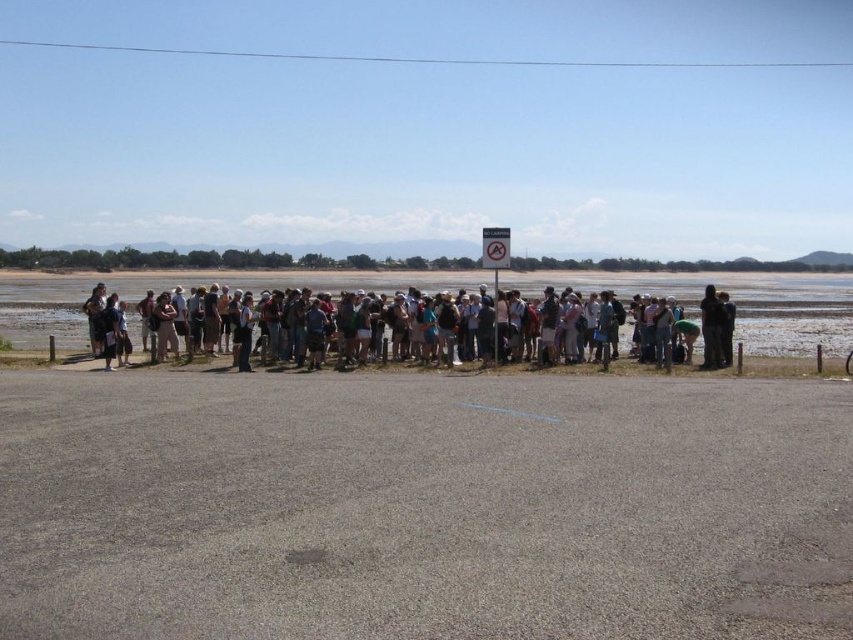
Can you confirm if clear blue sky at upper center is positioned to the left of matte black backpack at center?

No, clear blue sky at upper center is not to the left of matte black backpack at center.

Which is more to the right, clear blue sky at upper center or matte black backpack at center?

From the viewer's perspective, clear blue sky at upper center appears more on the right side.

Does point (270, 56) come closer to viewer compared to point (701, 320)?

That is False.

Image resolution: width=853 pixels, height=640 pixels. I want to click on clear blue sky at upper center, so click(x=421, y=58).